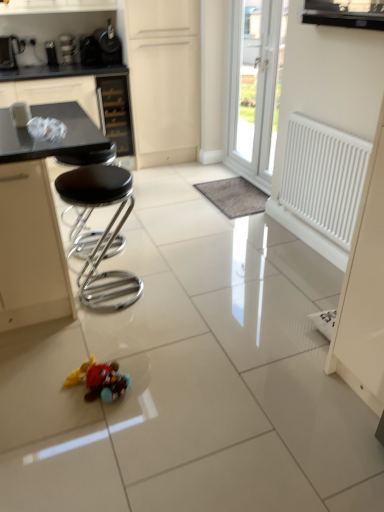
Question: Is brushed metal toaster at upper left, which is the third appliance from right to left, spatially inside plush toy at center, or outside of it?

Choices:
 (A) inside
 (B) outside

Answer: (B)

Question: Looking at the image, does brushed metal toaster at upper left, which is the third appliance from right to left, seem bigger or smaller compared to plush toy at center?

Choices:
 (A) small
 (B) big

Answer: (B)

Question: Which object is positioned closest to the gray fuzzy mat at center?

Choices:
 (A) metallic silver toaster at upper left, which ranks as the second appliance in left-to-right order
 (B) black glass drawer at upper center
 (C) white plastic door at upper center
 (D) metallic black coffee maker at upper left, positioned as the first appliance in right-to-left order
 (E) plush toy at center

Answer: (C)

Question: Estimate the real-world distances between objects in this image. Which object is farther from the black leather stool at left?

Choices:
 (A) black glass drawer at upper center
 (B) gray fuzzy mat at center
 (C) plush toy at center
 (D) matte cream cabinet at upper center
 (E) white matte radiator at right

Answer: (D)